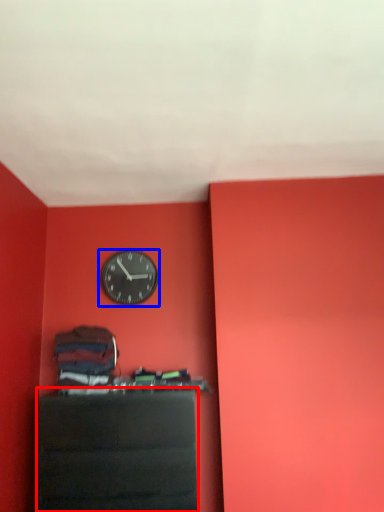
Question: Among these objects, which one is farthest to the camera, furniture (highlighted by a red box) or wall clock (highlighted by a blue box)?

Choices:
 (A) furniture
 (B) wall clock

Answer: (B)